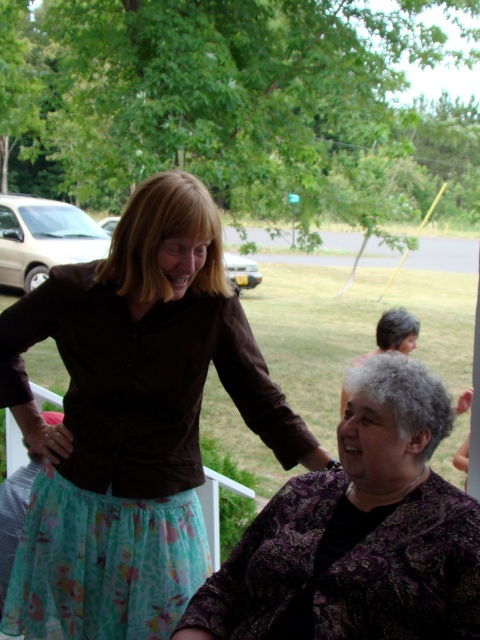
Who is positioned more to the left, purple paisley blouse at lower right or gray curly hair at lower center?

purple paisley blouse at lower right

Where is `purple paisley blouse at lower right`? The image size is (480, 640). purple paisley blouse at lower right is located at coordinates (358, 532).

Does point (196, 481) come behind point (389, 339)?

No, (196, 481) is in front of (389, 339).

Locate an element on the screen. floral chiffon skirt at upper left is located at coordinates (126, 424).

Is point (84, 440) farther from camera compared to point (204, 598)?

Yes, it is.

Is point (46, 595) less distant than point (478, 568)?

No.

The image size is (480, 640). I want to click on floral chiffon skirt at upper left, so click(x=126, y=424).